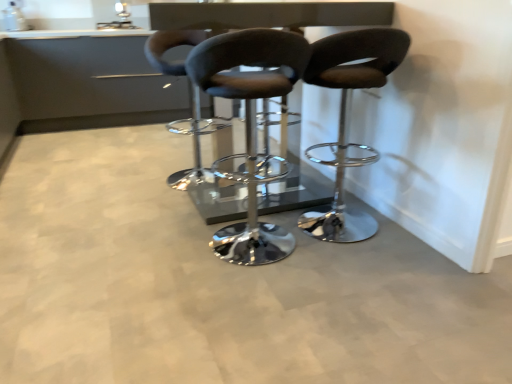
Question: Would you say matte black stool at center, which is counted as the second chair, starting from the left, is a long distance from matte black stool at center, placed as the 1th chair when sorted from right to left?

Choices:
 (A) no
 (B) yes

Answer: (A)

Question: Could matte black stool at center, placed as the 1th chair when sorted from right to left, be considered to be inside matte black stool at center, which is counted as the second chair, starting from the left?

Choices:
 (A) yes
 (B) no

Answer: (B)

Question: Does matte black stool at center, the second chair viewed from the right, have a greater width compared to matte black stool at center, placed as the 1th chair when sorted from right to left?

Choices:
 (A) no
 (B) yes

Answer: (A)

Question: Is matte black stool at center, the second chair viewed from the right, facing towards matte black stool at center, the 3th chair from the left?

Choices:
 (A) no
 (B) yes

Answer: (A)

Question: Is matte black stool at center, the second chair viewed from the right, closer to camera compared to matte black stool at center, the 3th chair from the left?

Choices:
 (A) no
 (B) yes

Answer: (B)

Question: Is glossy black table at center in front of or behind matte black stool at center, which is counted as the second chair, starting from the left, in the image?

Choices:
 (A) behind
 (B) front

Answer: (A)

Question: Is point (161, 28) positioned closer to the camera than point (289, 39)?

Choices:
 (A) farther
 (B) closer

Answer: (A)

Question: Considering the positions of glossy black table at center and matte black stool at center, the second chair viewed from the right, in the image, is glossy black table at center taller or shorter than matte black stool at center, the second chair viewed from the right,?

Choices:
 (A) tall
 (B) short

Answer: (A)

Question: Looking at the image, does glossy black table at center seem bigger or smaller compared to matte black stool at center, which is counted as the second chair, starting from the left?

Choices:
 (A) small
 (B) big

Answer: (B)

Question: From the image's perspective, is matte black stool at center, placed as the 1th chair when sorted from right to left, above or below glossy black table at center?

Choices:
 (A) below
 (B) above

Answer: (A)

Question: Is matte black stool at center, the 3th chair from the left, in front of or behind glossy black table at center in the image?

Choices:
 (A) front
 (B) behind

Answer: (A)

Question: Is matte black stool at center, the 3th chair from the left, bigger or smaller than glossy black table at center?

Choices:
 (A) big
 (B) small

Answer: (B)

Question: Considering the positions of matte black stool at center, the 3th chair from the left, and glossy black table at center in the image, is matte black stool at center, the 3th chair from the left, wider or thinner than glossy black table at center?

Choices:
 (A) wide
 (B) thin

Answer: (B)

Question: Is matte silver sink at upper center bigger or smaller than matte black stool at center, the second chair viewed from the right?

Choices:
 (A) small
 (B) big

Answer: (A)

Question: Looking at their shapes, would you say matte silver sink at upper center is wider or thinner than matte black stool at center, which is counted as the second chair, starting from the left?

Choices:
 (A) wide
 (B) thin

Answer: (B)